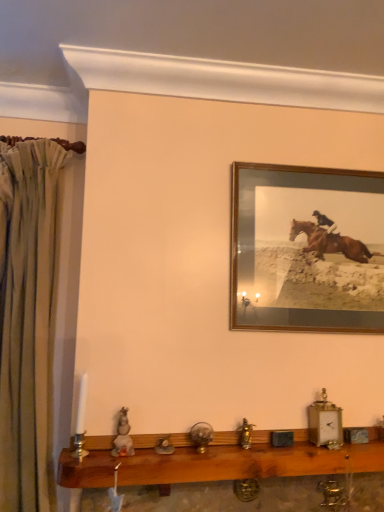
Find the location of a particular element. The height and width of the screenshot is (512, 384). blank space situated above wooden shelf at lower center (from a real-world perspective) is located at coordinates (240, 432).